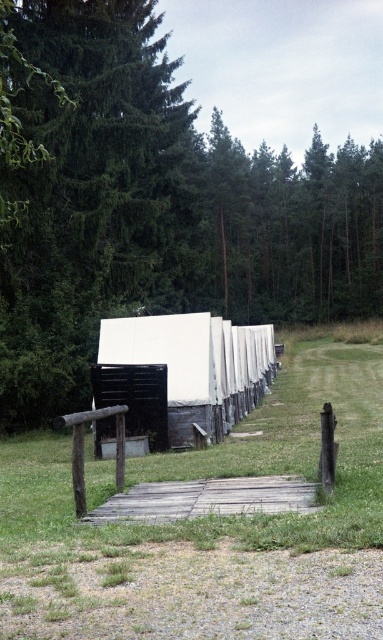
You are planning to place a small garden bench that is 1 meter wide on the green grass at center and wooden plank at center. Which location would be suitable for placing the bench without it overhanging?

The green grass at center is wider than the wooden plank at center, so the bench would fit better on the green grass at center since it has more space.

You are planning to place a small garden bench that is 1 meter wide between the green leafy tree at upper left and the wooden plank at center. Based on the scene, will the bench fit between them?

The green leafy tree at upper left is wider than the wooden plank at center. Since the bench is 1 meter wide, it depends on the actual space between them. However, the description only compares their widths, not the distance between them. Therefore, we cannot determine if the bench will fit based solely on the provided information.

You are standing on the wooden walkway and want to place a small potted plant on the green grass at center. Can you directly step onto the wooden plank at center to reach the grass?

The green grass at center is located above the wooden plank at center, so stepping onto the wooden plank at center would allow you to access the grass above it.